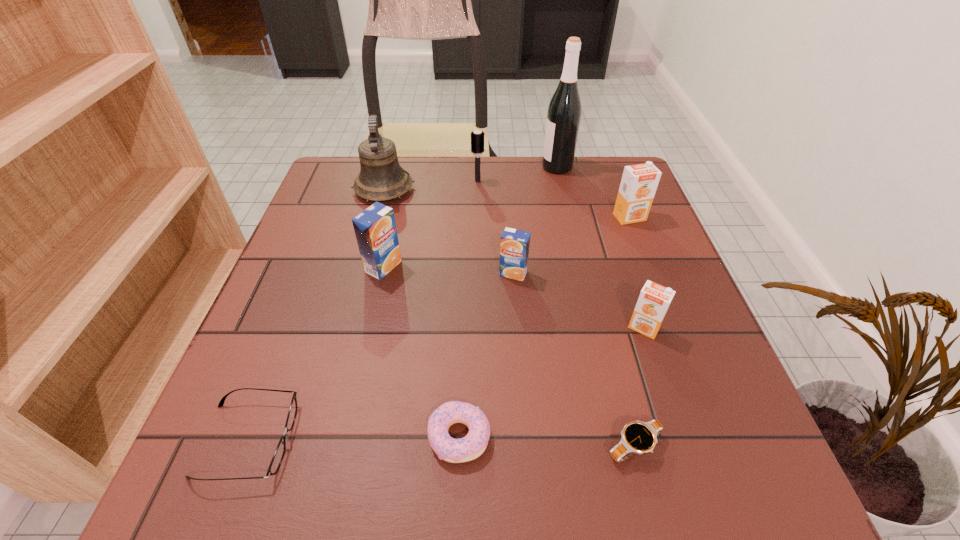
At what (x,y) coordinates should I click in order to perform the action: click on vacant region that satisfies the following two spatial constraints: 1. on the back side of the seventh nearest object; 2. on the left side of the black watch. Please return your answer as a coordinate pair (x, y). Looking at the image, I should click on (576, 217).